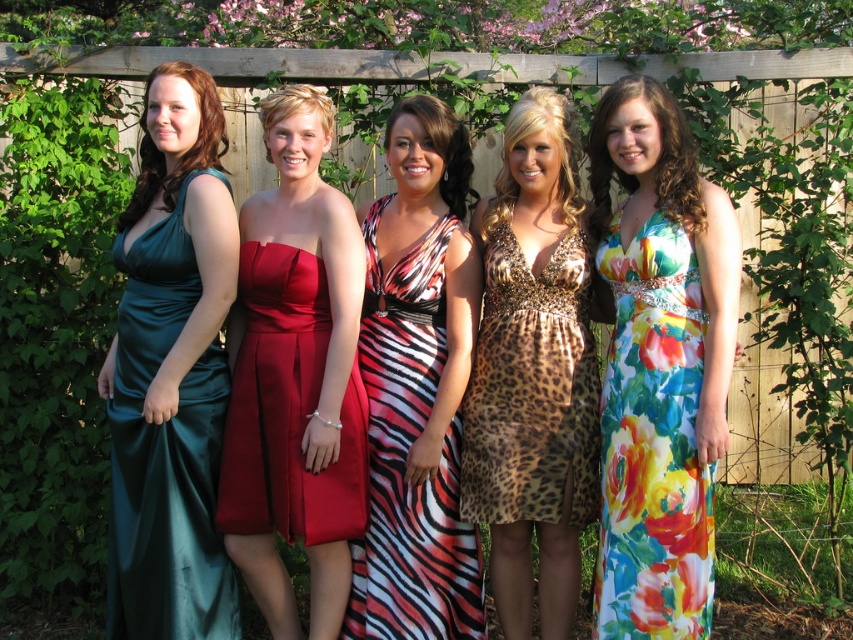
You are standing at the point closest to the wooden fence. Which of the two points, point (654, 444) or point (480, 508), is closer to you?

Point (654, 444) is in front of point (480, 508), so it is closer to you.

You are a photographer taking a picture of the two dresses, the floral silk dress at right and the teal satin dress at left. Which dress will appear larger in the photo?

The floral silk dress at right will appear larger in the photo because it is closer to the viewer than the teal satin dress at left.

You are a photographer at a prom event and need to arrange the two women in the image so that the teal satin dress at left is positioned to the left of the floral silk dress at right. Is this already the case in the current arrangement?

Yes, the floral silk dress at right is to the right of the teal satin dress at left in the current arrangement, so the requirement is already met.